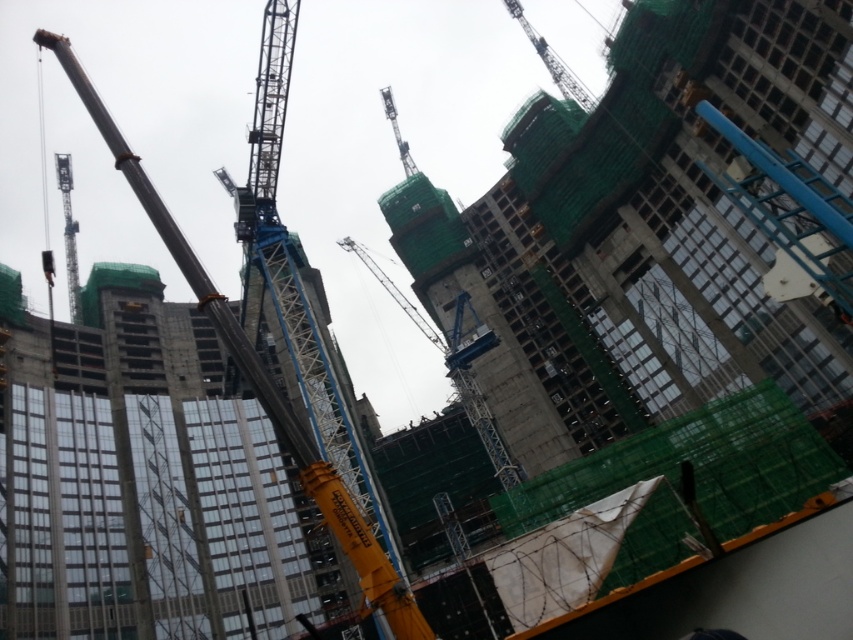
Which is more to the right, yellow metallic crane at left or metallic blue crane at upper center?

From the viewer's perspective, metallic blue crane at upper center appears more on the right side.

Is yellow metallic crane at left further to camera compared to metallic blue crane at upper center?

No.

You are a GUI agent. You are given a task and a screenshot of the screen. Output one action in this format:
    pyautogui.click(x=<x>, y=<y>)
    Task: Click on the yellow metallic crane at left
    The image size is (853, 640).
    Given the screenshot: What is the action you would take?
    pyautogui.click(x=259, y=380)

The width and height of the screenshot is (853, 640). Find the location of `yellow metallic crane at left`. yellow metallic crane at left is located at coordinates (259, 380).

Does metallic blue crane at upper center appear on the left side of metallic gray crane at center?

Incorrect, metallic blue crane at upper center is not on the left side of metallic gray crane at center.

Can you confirm if metallic blue crane at upper center is bigger than metallic gray crane at center?

Indeed, metallic blue crane at upper center has a larger size compared to metallic gray crane at center.

Does point (585, 100) come farther from viewer compared to point (381, 88)?

No.

Locate an element on the screen. metallic blue crane at upper center is located at coordinates (550, 60).

What are the coordinates of `green netted construction at upper center` in the screenshot? It's located at tap(640, 234).

Which is above, green netted construction at upper center or metallic blue crane at upper center?

metallic blue crane at upper center is above.

At what (x,y) coordinates should I click in order to perform the action: click on green netted construction at upper center. Please return your answer as a coordinate pair (x, y). The height and width of the screenshot is (640, 853). Looking at the image, I should click on (640, 234).

The height and width of the screenshot is (640, 853). Find the location of `green netted construction at upper center`. green netted construction at upper center is located at coordinates (640, 234).